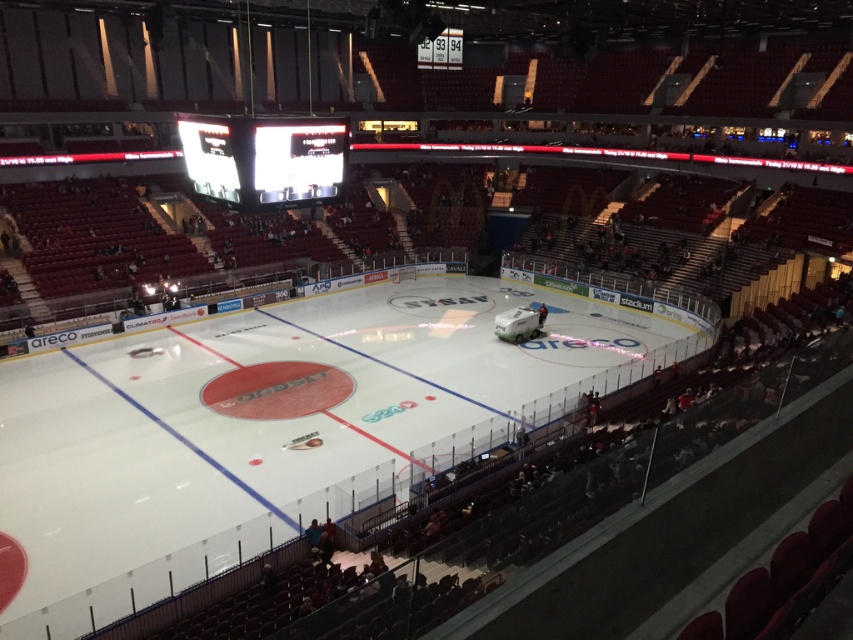
Question: Can you confirm if white smooth ice at center is thinner than white glossy scoreboard at upper center?

Choices:
 (A) no
 (B) yes

Answer: (A)

Question: Can you confirm if white smooth ice at center is thinner than white glossy scoreboard at upper center?

Choices:
 (A) yes
 (B) no

Answer: (B)

Question: Among these points, which one is farthest from the camera?

Choices:
 (A) (352, 492)
 (B) (287, 193)

Answer: (A)

Question: Is white smooth ice at center positioned before white glossy scoreboard at upper center?

Choices:
 (A) yes
 (B) no

Answer: (A)

Question: Among these objects, which one is nearest to the camera?

Choices:
 (A) white smooth ice at center
 (B) white glossy scoreboard at upper center

Answer: (A)